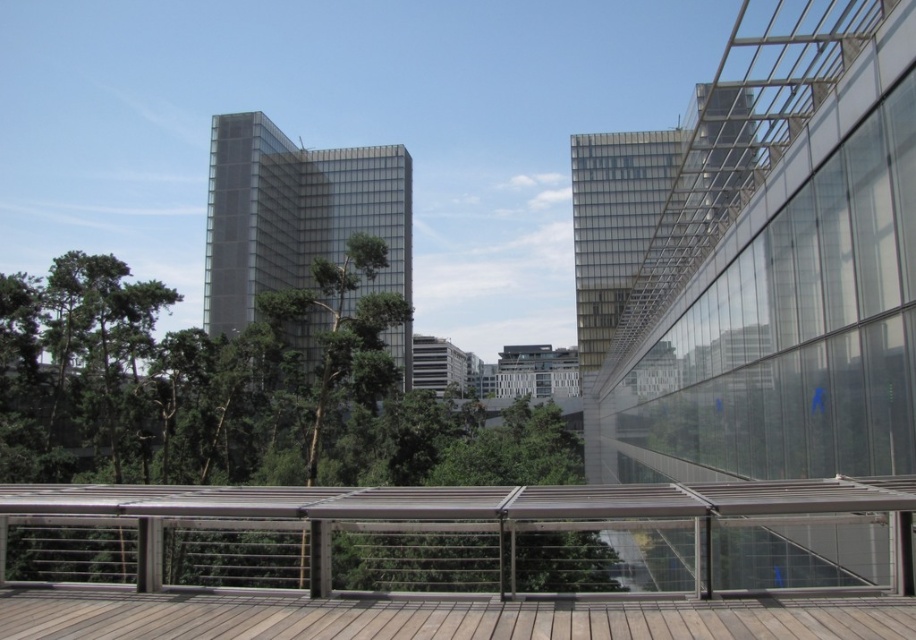
You are a construction inspector evaluating the image. You need to determine if the wooden deck at center can be accessed from the wooden deck at lower center. Based on their heights, is this possible?

The wooden deck at center has a greater height compared to wooden deck at lower center. Therefore, accessing the wooden deck at center from the wooden deck at lower center would require going upwards, which may not be possible without stairs or a ramp.

You are standing at the viewing platform on the wooden deck with a metal railing. There is a point marked at coordinates point (60, 326). Can you estimate how far this point is from your current position?

The point (60, 326) is 27.82 meters away from your current position.

In the scene shown: You are a construction inspector evaluating the wooden deck at center and the wooden deck at lower center. Which one requires more materials for maintenance due to its size?

The wooden deck at center requires more materials for maintenance because it is bigger than the wooden deck at lower center.